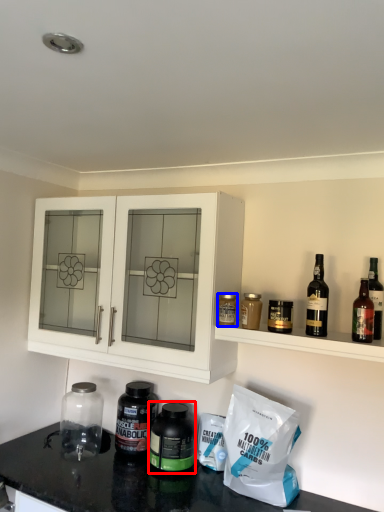
Question: Among these objects, which one is nearest to the camera, bottle (highlighted by a red box) or bottle (highlighted by a blue box)?

Choices:
 (A) bottle
 (B) bottle

Answer: (B)